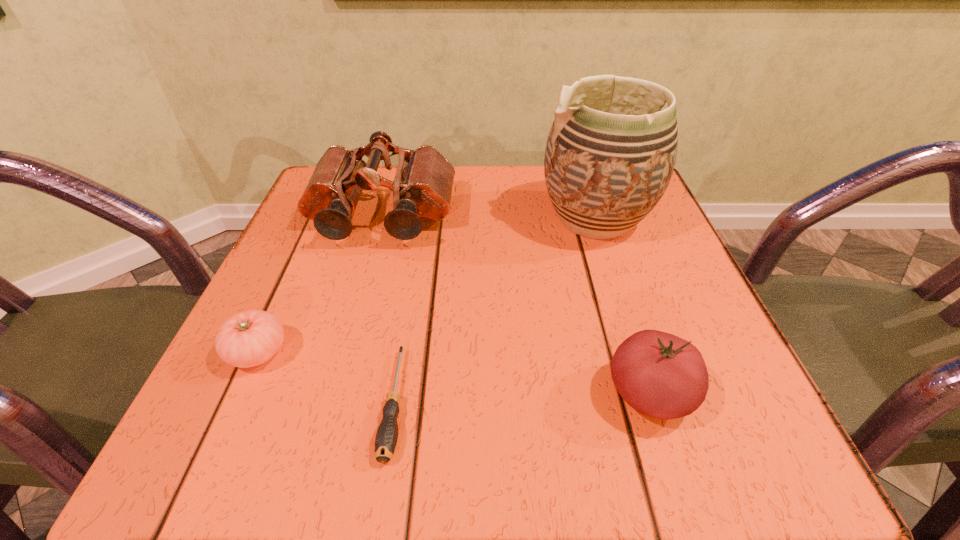
The height and width of the screenshot is (540, 960). In order to click on empty location between the taller tomato and the tallest object in this screenshot , I will do `click(622, 306)`.

Find the location of a particular element. This screenshot has width=960, height=540. vacant space that is in between the screwdriver and the fourth tallest object is located at coordinates tap(326, 378).

Where is `free space between the left tomato and the third shortest object`? The width and height of the screenshot is (960, 540). free space between the left tomato and the third shortest object is located at coordinates (453, 373).

You are a GUI agent. You are given a task and a screenshot of the screen. Output one action in this format:
    pyautogui.click(x=<x>, y=<y>)
    Task: Click on the free space between the shortest object and the right tomato
    
    Given the screenshot: What is the action you would take?
    pyautogui.click(x=522, y=399)

Identify the location of free space between the fourth shortest object and the taller tomato. (516, 305).

Image resolution: width=960 pixels, height=540 pixels. In order to click on vacant space in between the second tallest object and the left tomato in this screenshot , I will do `click(320, 285)`.

Image resolution: width=960 pixels, height=540 pixels. I want to click on free spot between the taller tomato and the fourth shortest object, so click(x=516, y=305).

This screenshot has width=960, height=540. In order to click on free spot between the third tallest object and the fourth shortest object in this screenshot , I will do `click(516, 305)`.

At what (x,y) coordinates should I click in order to perform the action: click on object identified as the fourth closest to the fourth shortest object. Please return your answer as a coordinate pair (x, y). The height and width of the screenshot is (540, 960). Looking at the image, I should click on (660, 375).

Select which object appears as the closest to the left tomato. Please provide its 2D coordinates. Your answer should be formatted as a tuple, i.e. [(x, y)], where the tuple contains the x and y coordinates of a point satisfying the conditions above.

[(386, 438)]